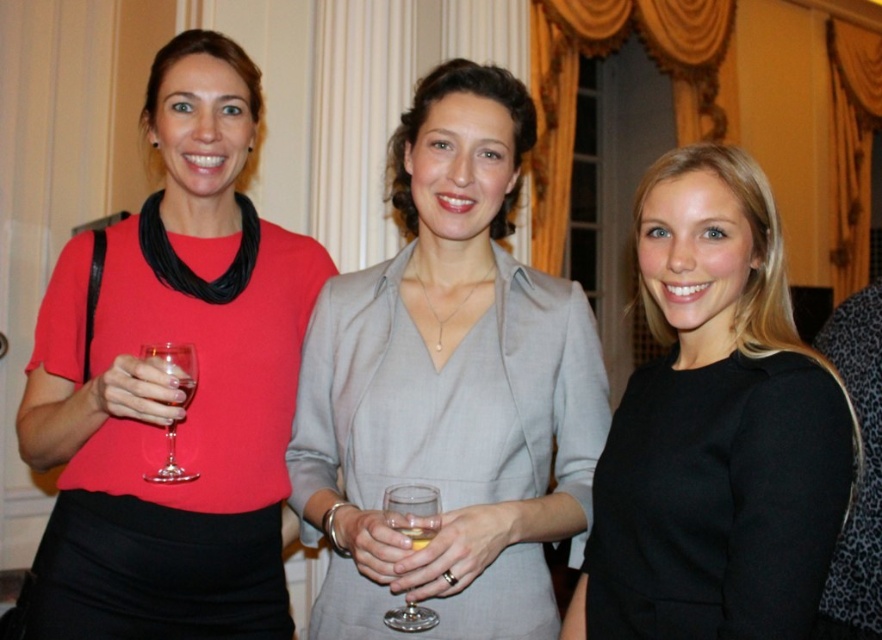
Question: Is matte red blouse at left to the left of transparent glass at center from the viewer's perspective?

Choices:
 (A) no
 (B) yes

Answer: (B)

Question: Does transparent glass at center come in front of transparent glass at left?

Choices:
 (A) yes
 (B) no

Answer: (A)

Question: Can you confirm if matte red blouse at left is bigger than transparent glass at center?

Choices:
 (A) no
 (B) yes

Answer: (B)

Question: Which of these objects is positioned closest to the matte red blouse at left?

Choices:
 (A) translucent glass at center
 (B) matte gray dress at center

Answer: (B)

Question: Among these points, which one is nearest to the camera?

Choices:
 (A) (412, 620)
 (B) (419, 531)

Answer: (B)

Question: Which is nearer to the matte red blouse at left?

Choices:
 (A) black matte dress at center
 (B) matte gray dress at center
 (C) transparent glass at center

Answer: (B)